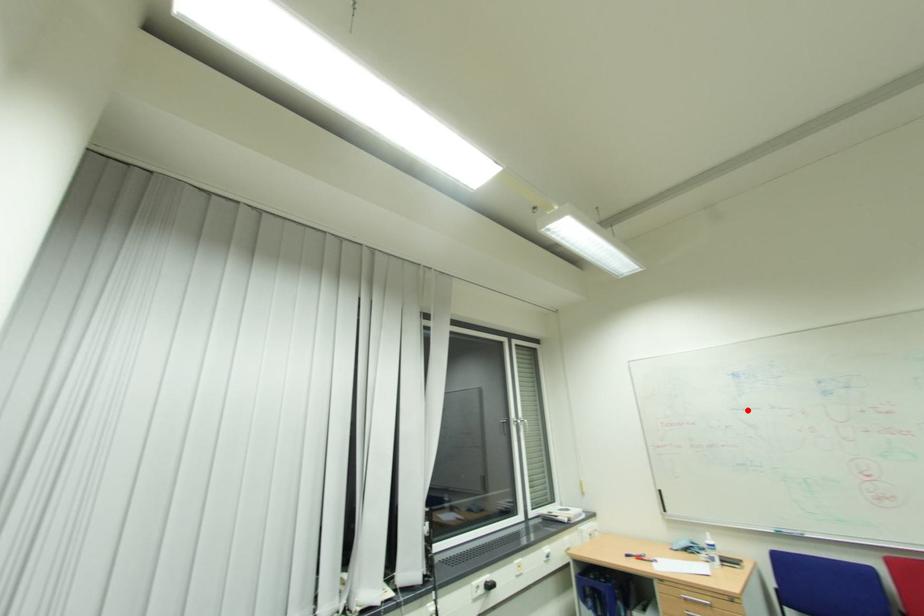
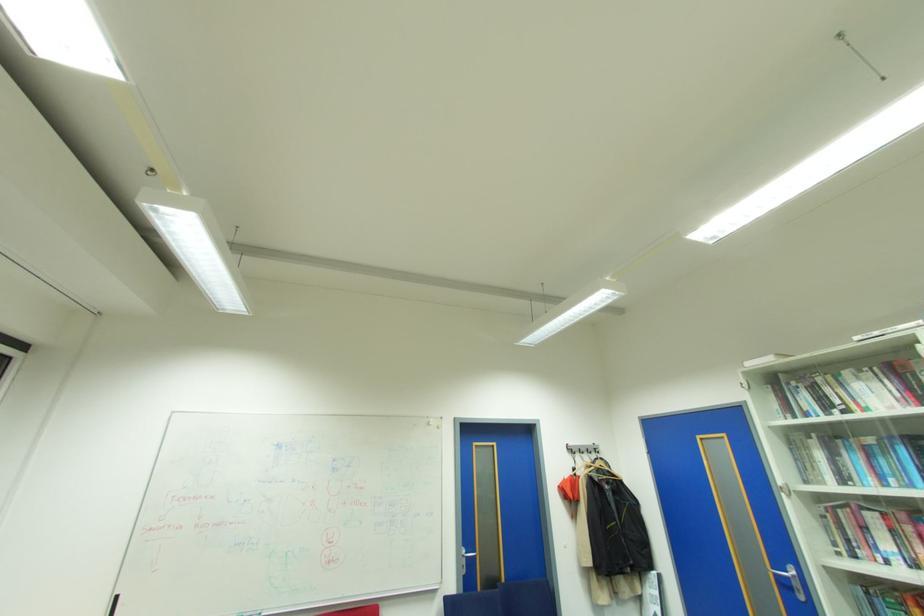
Find the pixel in the second image that matches the highlighted location in the first image.

(274, 482)